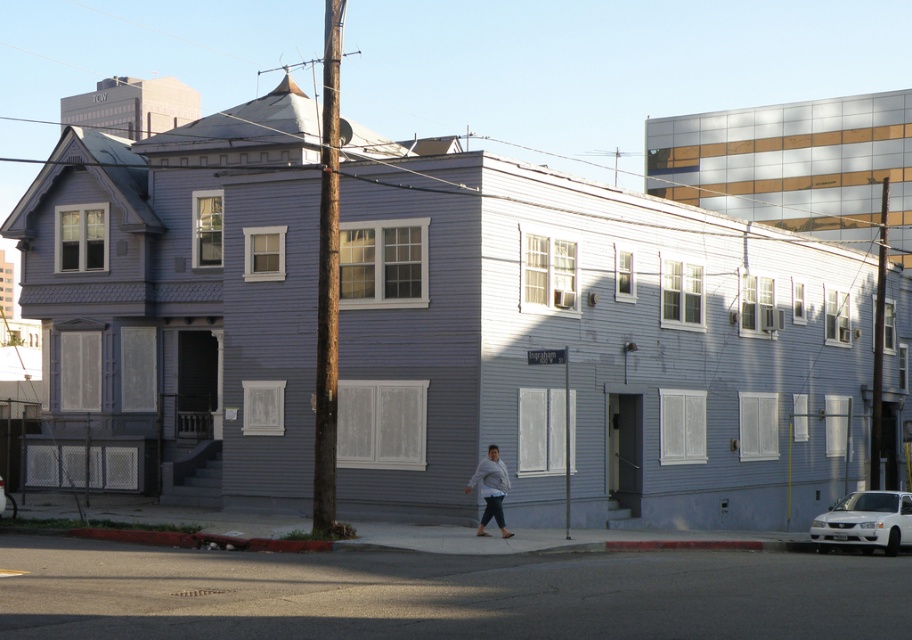
Consider the image. You are standing at the front entrance of the two story residential building and want to park your white glossy sedan at lower right. The property has a chain link fence. Is the point at coordinates (x=865, y=522) on the property or outside?

The point at coordinates (x=865, y=522) corresponds to the white glossy sedan at lower right, which is outside the property since the chain link fence surrounds part of the property, implying restricted access. Therefore, the sedan is parked outside the property.

You are standing on the sidewalk in front of the residential building and notice two points marked in the image. One is at coordinate point (494,483) and the other at point (0,497). Which point is closer to your current position?

Point (0,497) is closer to your current position because it is closer to the camera than point (494,483).